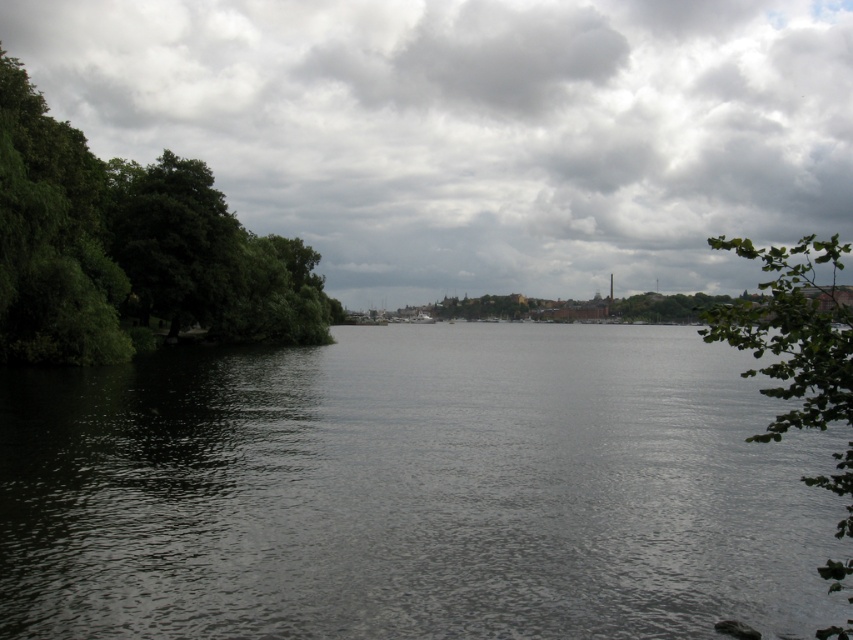
Question: Which object is closer to the camera taking this photo?

Choices:
 (A) cloudy sky at upper center
 (B) dark water at center
 (C) green leafy trees at left
 (D) green leafy branch at right

Answer: (D)

Question: Which is nearer to the green leafy branch at right?

Choices:
 (A) green leafy trees at left
 (B) dark water at center
 (C) cloudy sky at upper center

Answer: (B)

Question: Does green leafy trees at left come behind green leafy branch at right?

Choices:
 (A) no
 (B) yes

Answer: (B)

Question: Estimate the real-world distances between objects in this image. Which object is closer to the dark water at center?

Choices:
 (A) cloudy sky at upper center
 (B) green leafy trees at left
 (C) green leafy branch at right

Answer: (B)

Question: Does dark water at center have a larger size compared to cloudy sky at upper center?

Choices:
 (A) no
 (B) yes

Answer: (A)

Question: From the image, what is the correct spatial relationship of cloudy sky at upper center in relation to green leafy branch at right?

Choices:
 (A) right
 (B) left

Answer: (B)